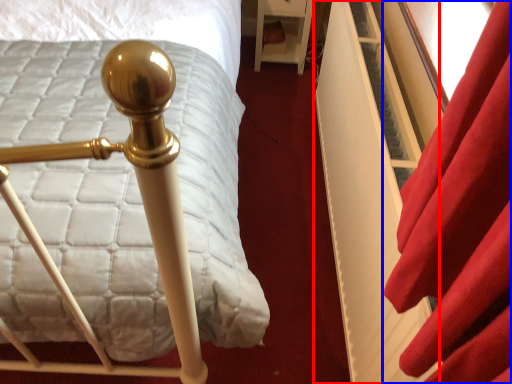
Question: Which object appears farthest to the camera in this image, bed frame (highlighted by a red box) or curtain (highlighted by a blue box)?

Choices:
 (A) bed frame
 (B) curtain

Answer: (A)